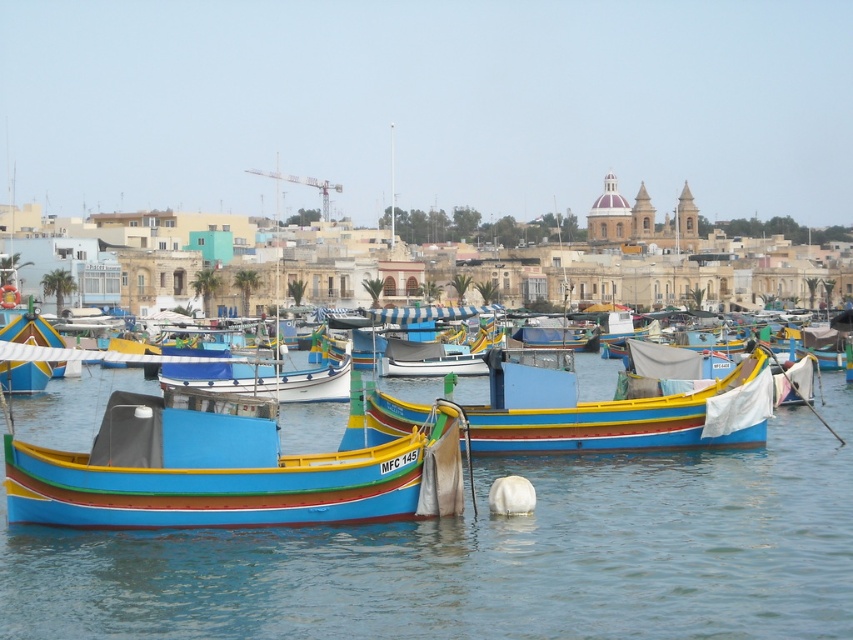
You are standing on the dock and looking at two points in the water. The first point is at coordinates point (431,397) and the second is at point (102,483). Which point is closer to you?

Point (102,483) is closer to you because it is less further to the camera than point (431,397).

You are a photographer planning to capture the entire scene of the blue water at center and the multicolored painted boat at center in one shot. Given that your camera has a fixed focal length, which object should you adjust your focus on to ensure both are in frame?

The blue water at center is larger in size than the multicolored painted boat at center, so you should focus on the blue water at center to ensure both are in frame.